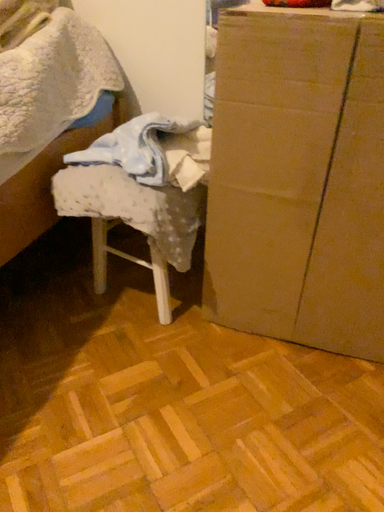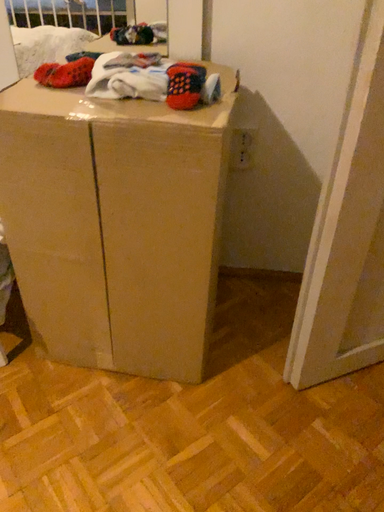
Question: How did the camera likely rotate when shooting the video?

Choices:
 (A) rotated left
 (B) rotated right

Answer: (B)